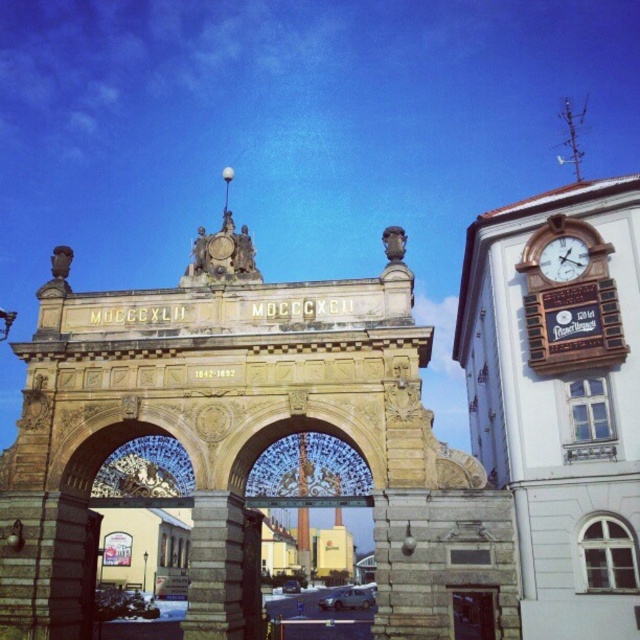
You are a maintenance worker needing to reach both the brown wooden door at center and the gold metallic clock at upper right for repairs. Given that your ladder can extend up to 70 feet, will you be able to safely reach both objects without needing a taller ladder?

The brown wooden door at center and gold metallic clock at upper right are 68.98 feet apart from each other, so yes, the ladder can reach both objects since its maximum extension of 70 feet is longer than the distance between them.

You are standing in front of the grand stone archway and notice two points marked on it. From your perspective, which point is closer to you, point (198,310) or point (570,246)?

Point (198,310) is further to the camera than point (570,246), so the point closer to you is point (570,246).